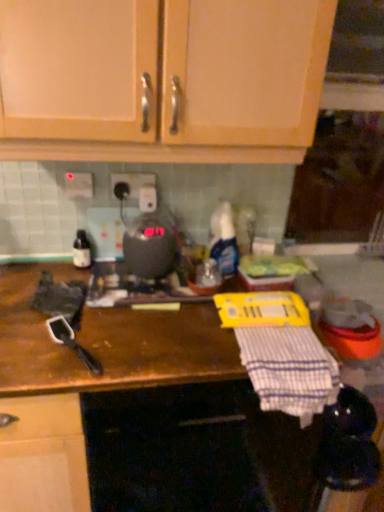
Question: Is wooden cabinet doors at upper center facing towards white plastic electric outlet at center, the 2th electric outlet positioned from the left?

Choices:
 (A) yes
 (B) no

Answer: (B)

Question: Is wooden cabinet doors at upper center located outside white plastic electric outlet at center, the 2th electric outlet positioned from the left?

Choices:
 (A) no
 (B) yes

Answer: (B)

Question: Is wooden cabinet doors at upper center behind white plastic electric outlet at center, the 2th electric outlet positioned from the left?

Choices:
 (A) yes
 (B) no

Answer: (B)

Question: Does wooden cabinet doors at upper center have a smaller size compared to white plastic electric outlet at center, the 1th electric outlet in the right-to-left sequence?

Choices:
 (A) no
 (B) yes

Answer: (A)

Question: Is wooden cabinet doors at upper center positioned with its back to white plastic electric outlet at center, the 1th electric outlet in the right-to-left sequence?

Choices:
 (A) yes
 (B) no

Answer: (B)

Question: Does point (87, 262) appear closer or farther from the camera than point (140, 429)?

Choices:
 (A) closer
 (B) farther

Answer: (B)

Question: Do you think matte glass bottle at left, the 1th bottle viewed from the left, is within brown wooden countertop at center, or outside of it?

Choices:
 (A) outside
 (B) inside

Answer: (A)

Question: In the image, is matte glass bottle at left, the 1th bottle viewed from the left, positioned in front of or behind brown wooden countertop at center?

Choices:
 (A) behind
 (B) front

Answer: (A)

Question: Is matte glass bottle at left, the 1th bottle viewed from the left, to the left or to the right of brown wooden countertop at center in the image?

Choices:
 (A) right
 (B) left

Answer: (B)

Question: Would you say white plastic electric outlet at upper center, arranged as the 2th electric outlet when viewed from the right, is inside or outside wooden cabinet doors at upper center?

Choices:
 (A) outside
 (B) inside

Answer: (A)

Question: From the image's perspective, is white plastic electric outlet at upper center, arranged as the 2th electric outlet when viewed from the right, above or below wooden cabinet doors at upper center?

Choices:
 (A) above
 (B) below

Answer: (B)

Question: Relative to wooden cabinet doors at upper center, is white plastic electric outlet at upper center, the 1th electric outlet positioned from the left, in front or behind?

Choices:
 (A) front
 (B) behind

Answer: (B)

Question: Looking at the image, does white plastic electric outlet at upper center, the 1th electric outlet positioned from the left, seem bigger or smaller compared to wooden cabinet doors at upper center?

Choices:
 (A) small
 (B) big

Answer: (A)

Question: Looking at their shapes, would you say white plastic electric outlet at upper center, the 1th electric outlet positioned from the left, is wider or thinner than translucent plastic spray bottle at center, acting as the second bottle starting from the left?

Choices:
 (A) wide
 (B) thin

Answer: (B)

Question: From the image's perspective, relative to translucent plastic spray bottle at center, acting as the second bottle starting from the left, is white plastic electric outlet at upper center, arranged as the 2th electric outlet when viewed from the right, above or below?

Choices:
 (A) above
 (B) below

Answer: (A)